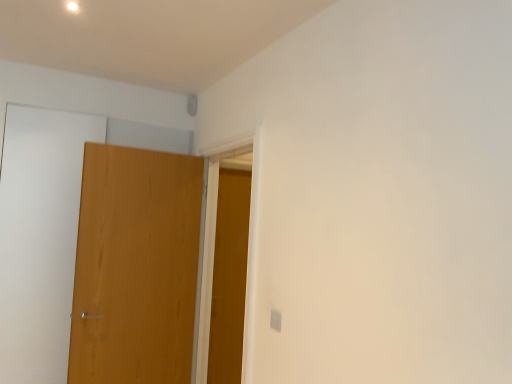
The width and height of the screenshot is (512, 384). I want to click on wooden door at left, arranged as the second door when viewed from the right, so click(135, 267).

The height and width of the screenshot is (384, 512). Describe the element at coordinates (135, 267) in the screenshot. I see `wooden door at left, marked as the 2th door in a back-to-front arrangement` at that location.

What do you see at coordinates (229, 277) in the screenshot? I see `wooden door at center, the first door when ordered from right to left` at bounding box center [229, 277].

The width and height of the screenshot is (512, 384). Find the location of `wooden door at center, arranged as the 1th door when viewed from the back`. wooden door at center, arranged as the 1th door when viewed from the back is located at coordinates (229, 277).

Where is `wooden door at left, arranged as the second door when viewed from the right`? This screenshot has width=512, height=384. wooden door at left, arranged as the second door when viewed from the right is located at coordinates click(135, 267).

Is wooden door at center, arranged as the 1th door when viewed from the back, at the left side of wooden door at left, arranged as the second door when viewed from the right?

No, wooden door at center, arranged as the 1th door when viewed from the back, is not to the left of wooden door at left, arranged as the second door when viewed from the right.

In the scene shown: Does wooden door at center, the first door when ordered from right to left, lie behind wooden door at left, marked as the 2th door in a back-to-front arrangement?

Yes, it is.

Is point (228, 312) positioned in front of point (193, 163)?

No.

From the image's perspective, is wooden door at center, marked as the second door in a front-to-back arrangement, on top of wooden door at left, arranged as the second door when viewed from the right?

No, from the image's perspective, wooden door at center, marked as the second door in a front-to-back arrangement, is not over wooden door at left, arranged as the second door when viewed from the right.

From a real-world perspective, between wooden door at center, marked as the second door in a front-to-back arrangement, and wooden door at left, marked as the 2th door in a back-to-front arrangement, who is vertically lower?

wooden door at center, marked as the second door in a front-to-back arrangement, from a real-world perspective.

Between wooden door at center, arranged as the 1th door when viewed from the back, and wooden door at left, positioned as the first door in left-to-right order, which one has larger width?

With larger width is wooden door at left, positioned as the first door in left-to-right order.

Between wooden door at center, the first door when ordered from right to left, and wooden door at left, positioned as the 1th door in front-to-back order, which one has less height?

With less height is wooden door at left, positioned as the 1th door in front-to-back order.

Who is smaller, wooden door at center, the second door from the left, or wooden door at left, marked as the 2th door in a back-to-front arrangement?

Smaller between the two is wooden door at center, the second door from the left.

Is wooden door at center, the first door when ordered from right to left, situated inside wooden door at left, positioned as the first door in left-to-right order, or outside?

wooden door at center, the first door when ordered from right to left, is spatially situated outside wooden door at left, positioned as the first door in left-to-right order.

Is wooden door at center, marked as the second door in a front-to-back arrangement, beside wooden door at left, positioned as the first door in left-to-right order?

No, wooden door at center, marked as the second door in a front-to-back arrangement, is not in contact with wooden door at left, positioned as the first door in left-to-right order.

Is wooden door at center, the second door from the left, facing away from wooden door at left, positioned as the first door in left-to-right order?

wooden door at center, the second door from the left, is not turned away from wooden door at left, positioned as the first door in left-to-right order.

Measure the distance between wooden door at center, marked as the second door in a front-to-back arrangement, and wooden door at left, marked as the 2th door in a back-to-front arrangement.

They are 23.73 inches apart.

At what (x,y) coordinates should I click in order to perform the action: click on door below the wooden door at left, arranged as the second door when viewed from the right (from a real-world perspective). Please return your answer as a coordinate pair (x, y). The image size is (512, 384). Looking at the image, I should click on (229, 277).

Considering the positions of objects wooden door at left, positioned as the first door in left-to-right order, and wooden door at center, marked as the second door in a front-to-back arrangement, in the image provided, who is more to the left, wooden door at left, positioned as the first door in left-to-right order, or wooden door at center, marked as the second door in a front-to-back arrangement,?

Positioned to the left is wooden door at left, positioned as the first door in left-to-right order.

Is wooden door at left, marked as the 2th door in a back-to-front arrangement, positioned in front of wooden door at center, arranged as the 1th door when viewed from the back?

That is True.

Does point (158, 245) come closer to viewer compared to point (230, 237)?

Yes.

From the image's perspective, is wooden door at left, positioned as the first door in left-to-right order, above wooden door at center, the second door from the left?

Yes.

From a real-world perspective, is wooden door at left, marked as the 2th door in a back-to-front arrangement, on wooden door at center, arranged as the 1th door when viewed from the back?

Yes, from a real-world perspective, wooden door at left, marked as the 2th door in a back-to-front arrangement, is on top of wooden door at center, arranged as the 1th door when viewed from the back.

Considering the relative sizes of wooden door at left, arranged as the second door when viewed from the right, and wooden door at center, the first door when ordered from right to left, in the image provided, is wooden door at left, arranged as the second door when viewed from the right, thinner than wooden door at center, the first door when ordered from right to left,?

No.

Which of these two, wooden door at left, positioned as the first door in left-to-right order, or wooden door at center, marked as the second door in a front-to-back arrangement, stands taller?

wooden door at center, marked as the second door in a front-to-back arrangement, is taller.

Can you confirm if wooden door at left, arranged as the second door when viewed from the right, is smaller than wooden door at center, the first door when ordered from right to left?

Incorrect, wooden door at left, arranged as the second door when viewed from the right, is not smaller in size than wooden door at center, the first door when ordered from right to left.

Is wooden door at left, positioned as the first door in left-to-right order, positioned beyond the bounds of wooden door at center, the second door from the left?

Yes, wooden door at left, positioned as the first door in left-to-right order, is located beyond the bounds of wooden door at center, the second door from the left.

Is wooden door at left, positioned as the 1th door in front-to-back order, next to wooden door at center, the first door when ordered from right to left, and touching it?

No, wooden door at left, positioned as the 1th door in front-to-back order, is not making contact with wooden door at center, the first door when ordered from right to left.

Does wooden door at left, positioned as the first door in left-to-right order, turn towards wooden door at center, arranged as the 1th door when viewed from the back?

No, wooden door at left, positioned as the first door in left-to-right order, is not turned towards wooden door at center, arranged as the 1th door when viewed from the back.

I want to click on door in front of the wooden door at center, the second door from the left, so click(135, 267).

Identify the location of door on the right of wooden door at left, positioned as the first door in left-to-right order. This screenshot has width=512, height=384. (229, 277).

The height and width of the screenshot is (384, 512). In the image, there is a wooden door at center, arranged as the 1th door when viewed from the back. What are the coordinates of `door above it (from the image's perspective)` in the screenshot? It's located at (135, 267).